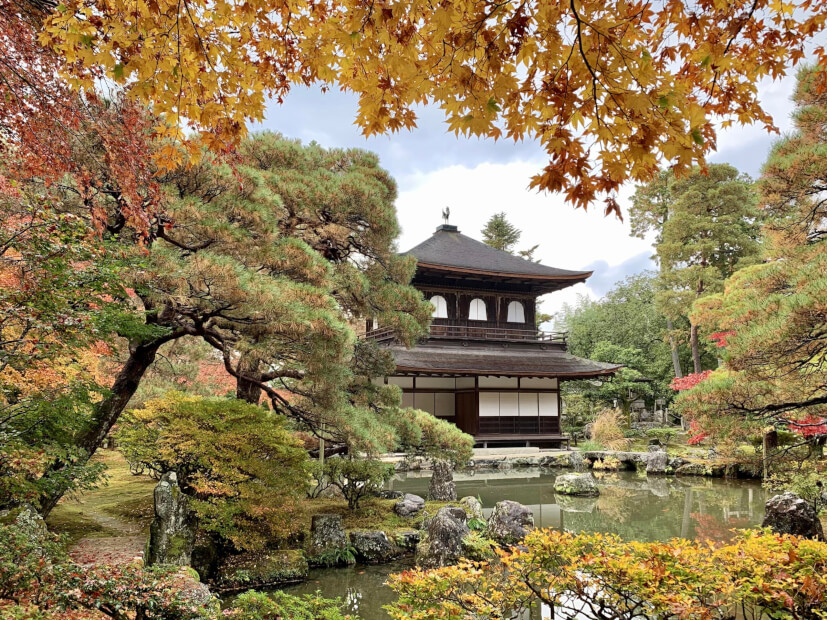
The height and width of the screenshot is (620, 827). Find the location of `metallic silver rooster decoration`. metallic silver rooster decoration is located at coordinates (443, 213).